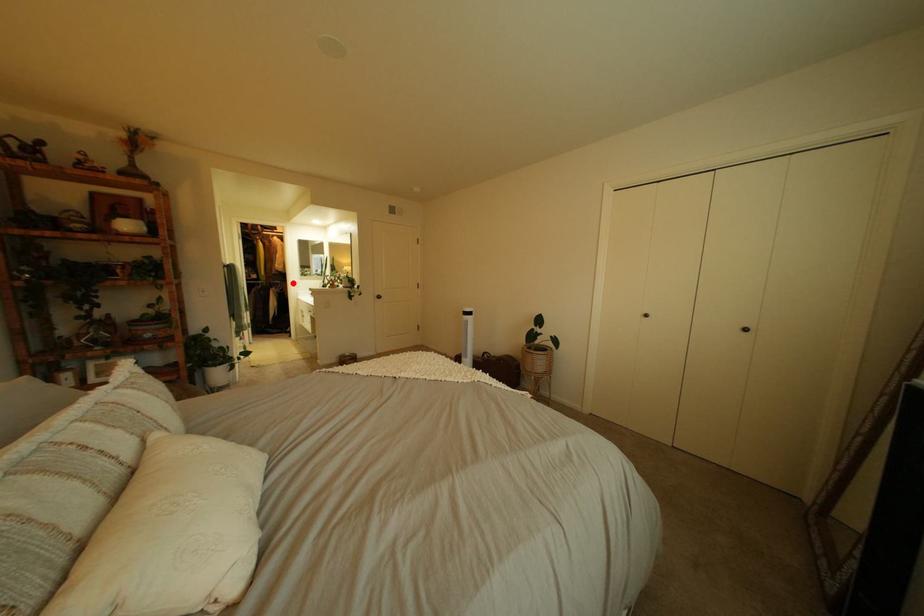
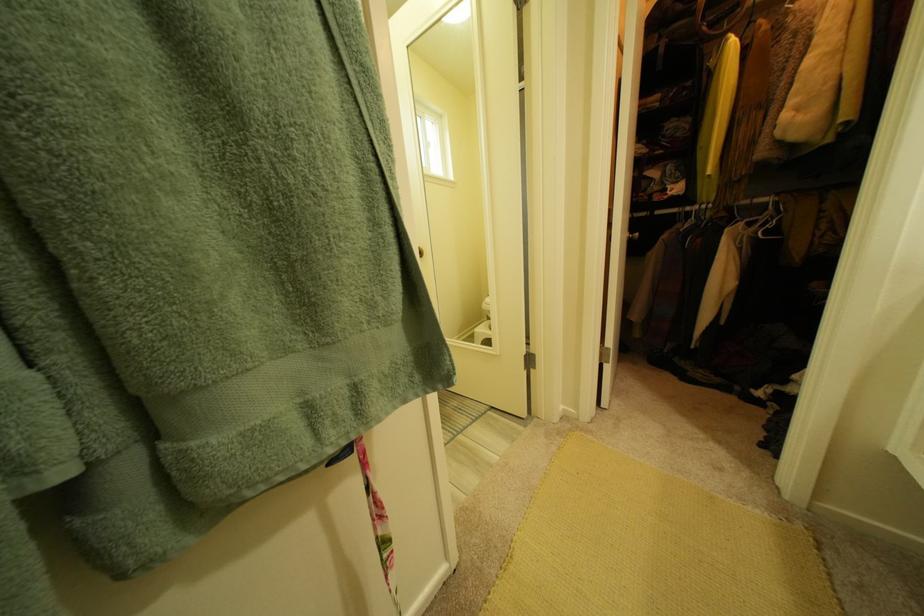
Where in the second image is the point corresponding to the highlighted location from the first image?

(777, 201)